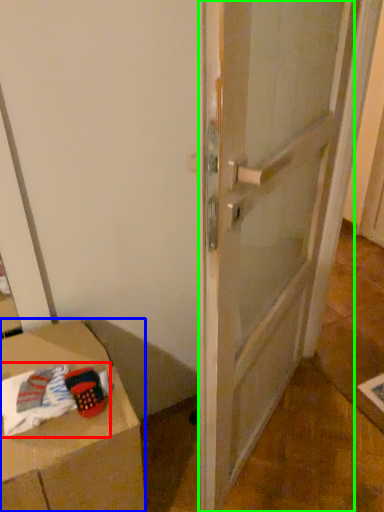
Question: Based on their relative distances, which object is farther from laundry (highlighted by a red box)? Choose from furniture (highlighted by a blue box) and door (highlighted by a green box).

Choices:
 (A) furniture
 (B) door

Answer: (B)